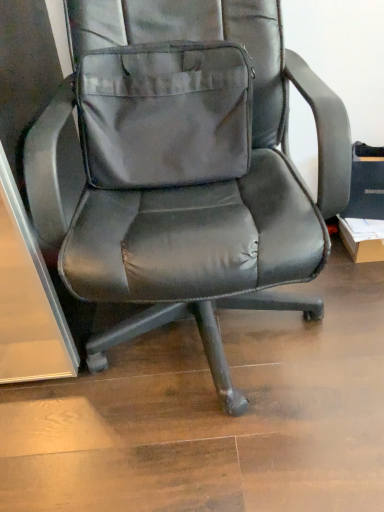
Question: Should I look upward or downward to see black leather office chair at center?

Choices:
 (A) down
 (B) up

Answer: (B)

Question: Is gray fabric pocket at center shorter than black leather office chair at center?

Choices:
 (A) no
 (B) yes

Answer: (B)

Question: Is gray fabric pocket at center smaller than black leather office chair at center?

Choices:
 (A) yes
 (B) no

Answer: (A)

Question: Is black leather office chair at center at the back of gray fabric pocket at center?

Choices:
 (A) no
 (B) yes

Answer: (B)

Question: Is gray fabric pocket at center not within black leather office chair at center?

Choices:
 (A) no
 (B) yes

Answer: (A)

Question: Is gray fabric pocket at center next to black leather office chair at center?

Choices:
 (A) yes
 (B) no

Answer: (A)

Question: From a real-world perspective, is gray fabric pocket at center under black leather office chair at center?

Choices:
 (A) yes
 (B) no

Answer: (B)

Question: Can you see black leather office chair at center touching gray fabric pocket at center?

Choices:
 (A) yes
 (B) no

Answer: (A)

Question: From the image's perspective, is black leather office chair at center on gray fabric pocket at center?

Choices:
 (A) no
 (B) yes

Answer: (A)

Question: Is black leather office chair at center shorter than gray fabric pocket at center?

Choices:
 (A) yes
 (B) no

Answer: (B)

Question: Does black leather office chair at center have a greater width compared to gray fabric pocket at center?

Choices:
 (A) no
 (B) yes

Answer: (B)

Question: Considering the relative sizes of black leather office chair at center and gray fabric pocket at center in the image provided, is black leather office chair at center taller than gray fabric pocket at center?

Choices:
 (A) yes
 (B) no

Answer: (A)

Question: Are black leather office chair at center and gray fabric pocket at center located far from each other?

Choices:
 (A) yes
 (B) no

Answer: (B)

Question: From their relative heights in the image, would you say black leather office chair at center is taller or shorter than gray fabric pocket at center?

Choices:
 (A) tall
 (B) short

Answer: (A)